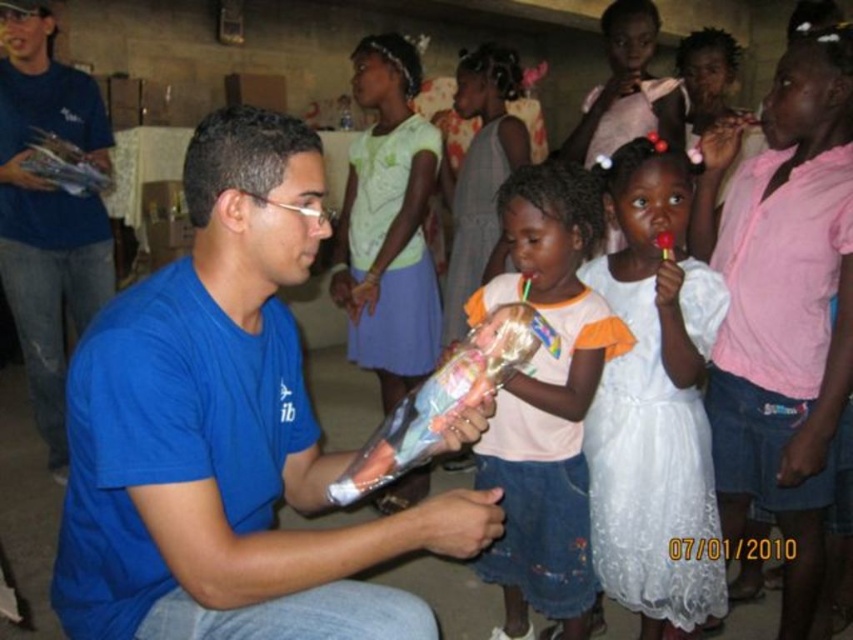
You are a photographer at a childrens event. You need to take a photo of the two girls wearing the white lace dress at center and the pink cotton dress at center. How far apart should you position them to ensure they are both in the frame?

The white lace dress at center is 6.51 inches from the pink cotton dress at center, so you should position them approximately 6.51 inches apart to ensure they are both in the frame.

You are organizing a clothing donation drive and need to categorize items by size. You have a blue cotton shirt at center and a pink cotton dress at center. Which item should you place in the large size bin?

The blue cotton shirt at center should be placed in the large size bin because it has a larger size compared to the pink cotton dress at center.

You are a photographer trying to capture a candid shot of the two children and the man in the scene. Since you want to ensure both the blue cotton shirt at center and the pink cotton dress at center are clearly visible in the frame, which one should you focus on first to avoid blurring due to their relative heights?

The blue cotton shirt at center is not as tall as the pink cotton dress at center, so you should focus on the pink cotton dress at center first to ensure it is in clear focus before adjusting for the shorter blue cotton shirt at center.